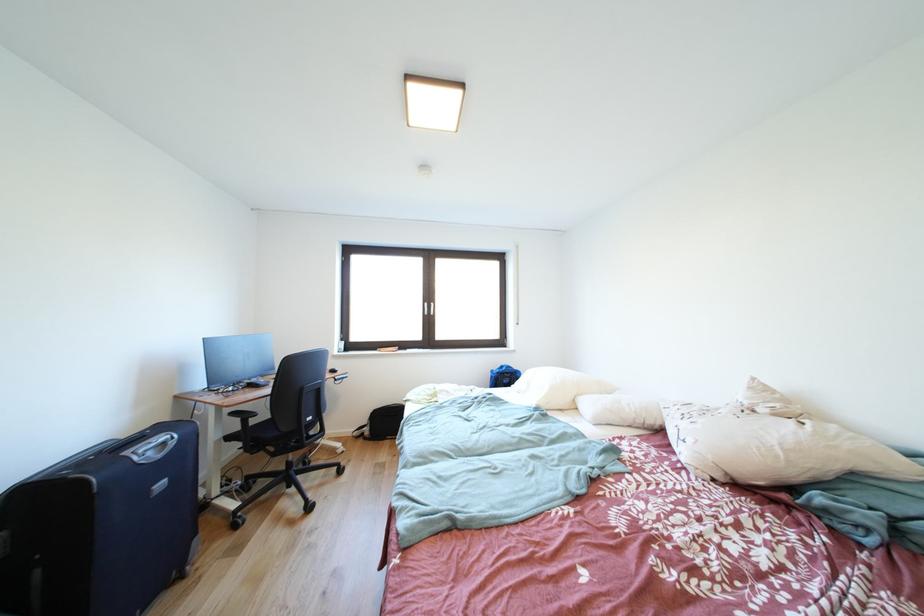
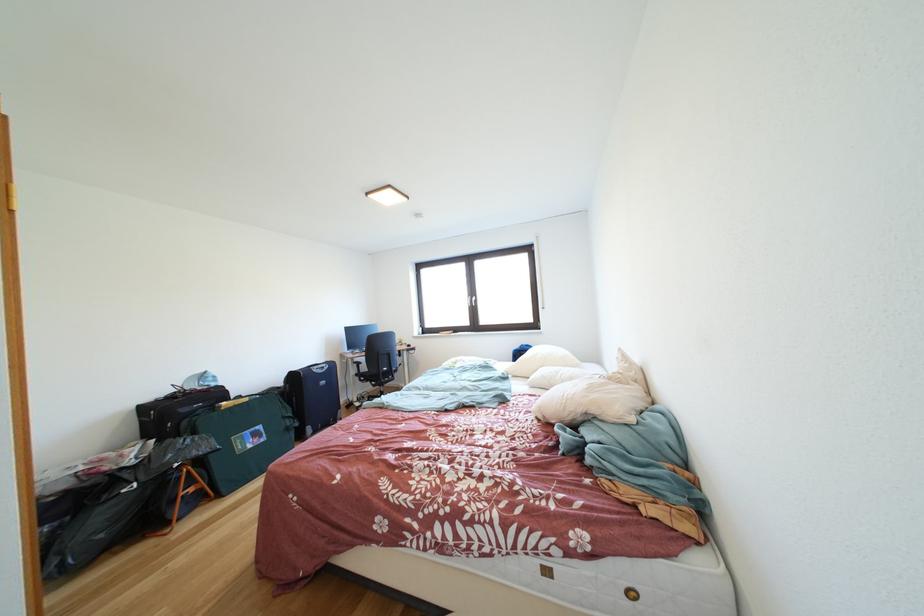
The point at (x=727, y=482) is marked in the first image. Where is the corresponding point in the second image?

(549, 421)